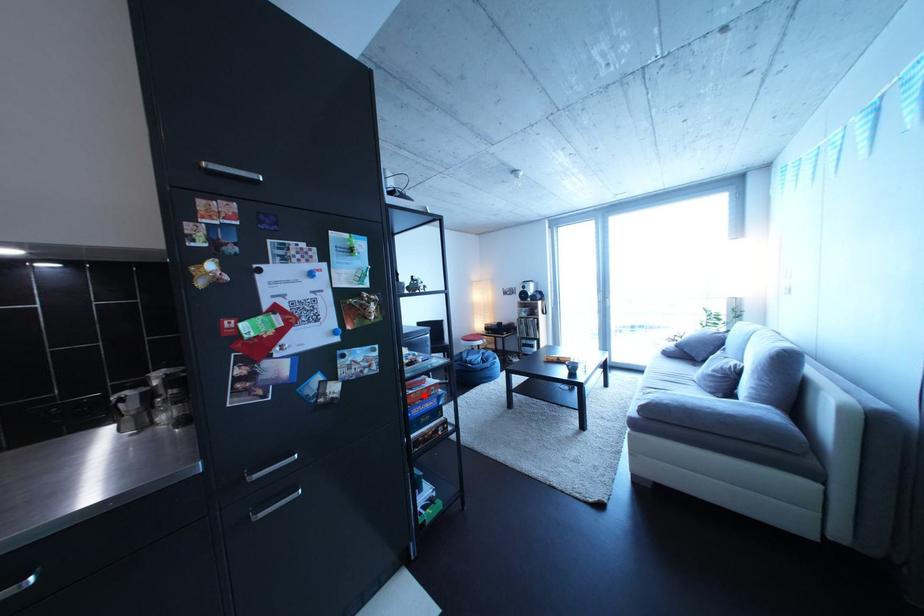
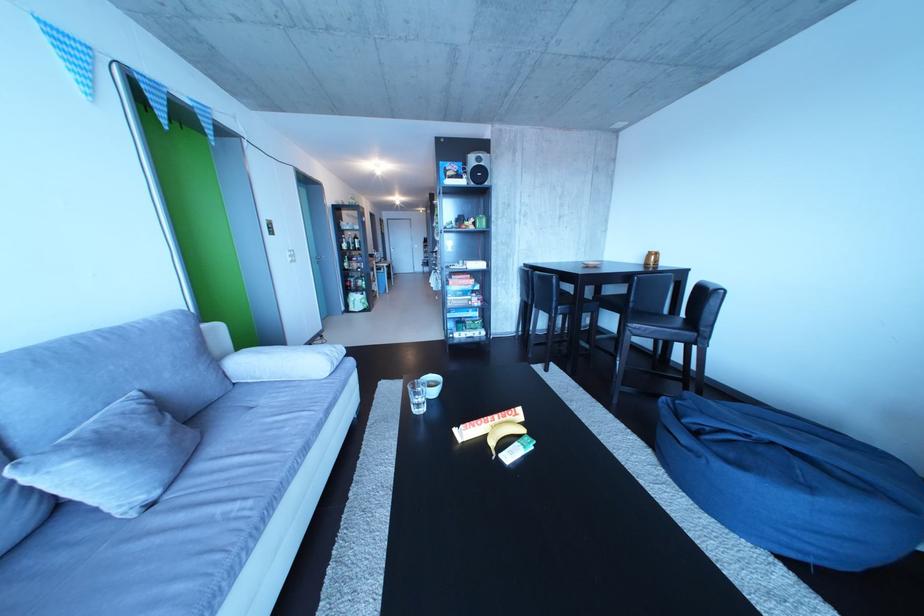
Question: I am providing you with two images of the same scene from different viewpoints. A red point is marked on the first image. At the location where the point appears in image 1, is it still visible in image 2?

Choices:
 (A) Yes
 (B) No

Answer: (B)